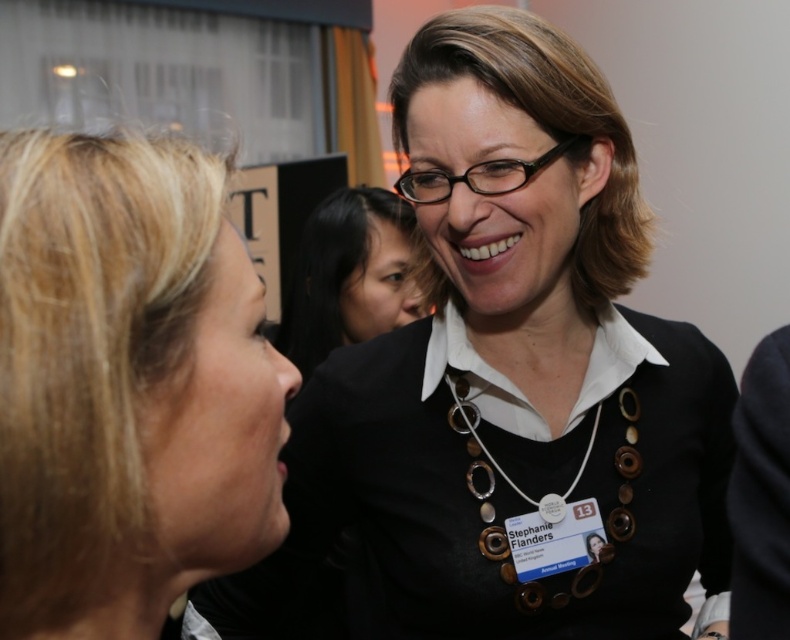
You are a photographer adjusting the focus on your camera. You want to capture a clear image of both the black matte necklace at upper center and the matte black shirt at center. Given the current focus settings, the camera can only sharply focus on objects within a 30 inch range. Can you achieve sharp focus on both objects simultaneously?

The distance between the black matte necklace at upper center and the matte black shirt at center is 34.09 inches, which exceeds the camera focus range of 30 inches. Therefore, it is not possible to have both objects in sharp focus at the same time.

You are at a networking event and want to approach the woman with the distinctive necklace. She is standing near the center of the image. How would you describe the position of the black matte necklace at upper center relative to the matte black shirt at center?

The black matte necklace at upper center is positioned below the matte black shirt at center, so it is hanging down from the shirt.

You are at a networking event and want to approach the person with the blonde hair at upper left and the matte black shirt at center. Based on their positions, which one is closer to the entrance?

The blonde hair at upper left is not as tall as matte black shirt at center, so the blonde hair at upper left is closer to the entrance.